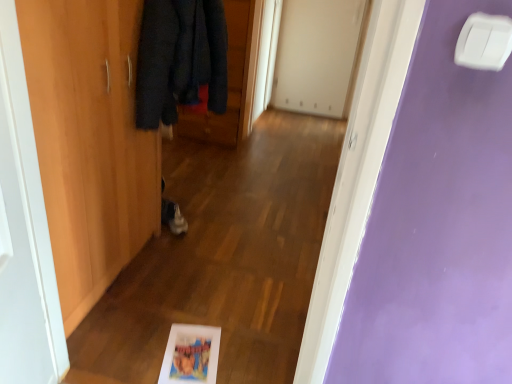
This screenshot has width=512, height=384. What are the coordinates of `vacant point to the right of wooden wardrobe at left, the second door when ordered from back to front` in the screenshot? It's located at (198, 287).